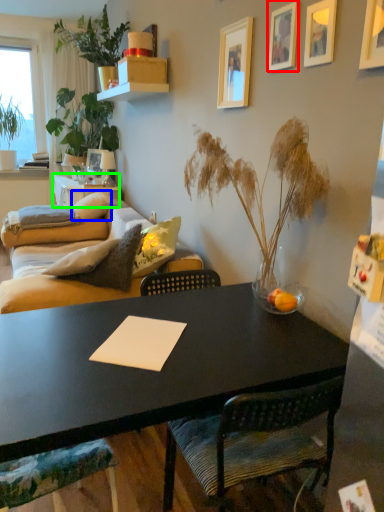
Question: Which object is positioned farthest from picture frame (highlighted by a red box)? Select from pillow (highlighted by a blue box) and desk (highlighted by a green box).

Choices:
 (A) pillow
 (B) desk

Answer: (B)